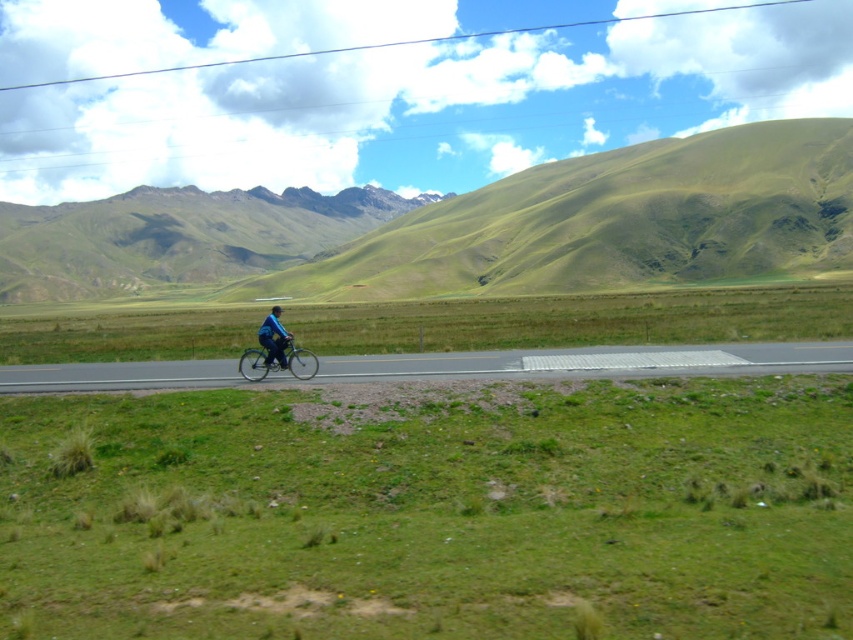
Based on the coordinates provided, where is the green grassy hill at upper center located in the image?

The green grassy hill at upper center is located at the 2D coordinates point (610,221) in the image.

You are a drone operator trying to fly a drone from the black matte helmet at center to the green grassy hill at upper center. Based on the scene, can you determine if the drone will have a clear path without obstacles between them?

The green grassy hill at upper center is positioned over the black matte helmet at center, so the drone will have a clear path without obstacles between them.

From the picture: You are a photographer positioned at the edge of the road. You see the blue fabric jacket at center and the black matte helmet at center in your viewfinder. Which object is closer to the bottom edge of your camera frame?

The blue fabric jacket at center is closer to the bottom edge of the camera frame because it is positioned below the black matte helmet at center.